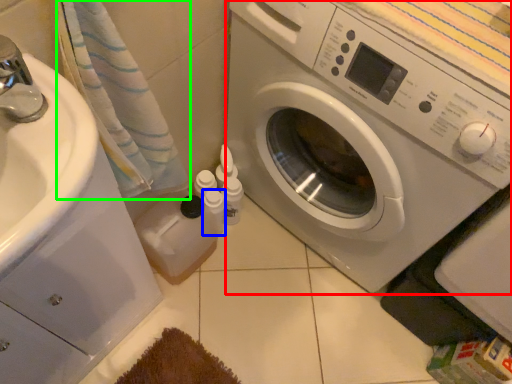
Question: Based on their relative distances, which object is nearer to washing machine (highlighted by a red box)? Choose from toiletry (highlighted by a blue box) and bath towel (highlighted by a green box).

Choices:
 (A) toiletry
 (B) bath towel

Answer: (B)